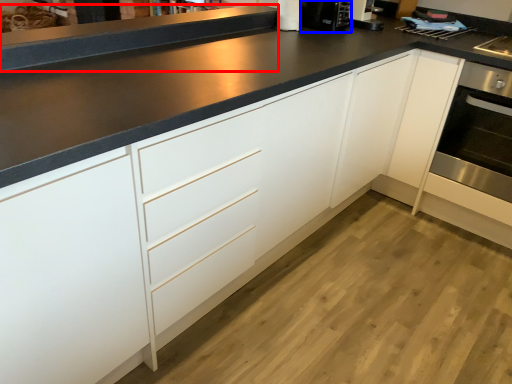
Question: Which of the following is the farthest to the observer, counter top (highlighted by a red box) or coffee machine (highlighted by a blue box)?

Choices:
 (A) counter top
 (B) coffee machine

Answer: (B)